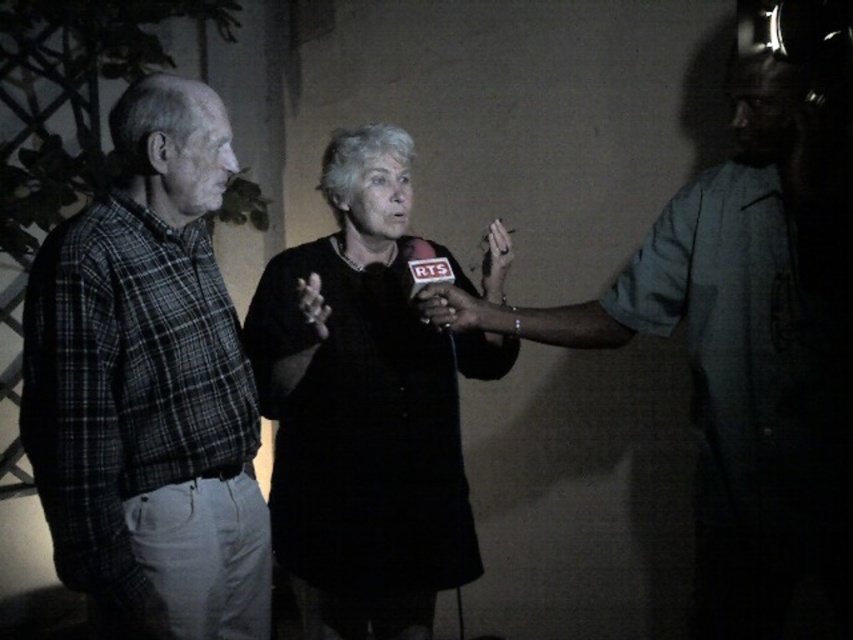
Question: Estimate the real-world distances between objects in this image. Which object is farther from the black matte dress at center?

Choices:
 (A) matte gray shirt at right
 (B) plaid shirt at left

Answer: (A)

Question: Can you confirm if plaid shirt at left is smaller than smooth skin hand at center?

Choices:
 (A) yes
 (B) no

Answer: (B)

Question: Among these objects, which one is nearest to the camera?

Choices:
 (A) plaid shirt at left
 (B) black matte microphone at center

Answer: (A)

Question: Among these objects, which one is farthest from the camera?

Choices:
 (A) plaid shirt at left
 (B) smooth skin hand at center
 (C) black matte dress at center
 (D) matte gray shirt at right

Answer: (B)

Question: Can you confirm if plaid shirt at left is bigger than black matte dress at center?

Choices:
 (A) no
 (B) yes

Answer: (A)

Question: Considering the relative positions of matte gray shirt at right and black matte dress at center in the image provided, where is matte gray shirt at right located with respect to black matte dress at center?

Choices:
 (A) below
 (B) above

Answer: (B)